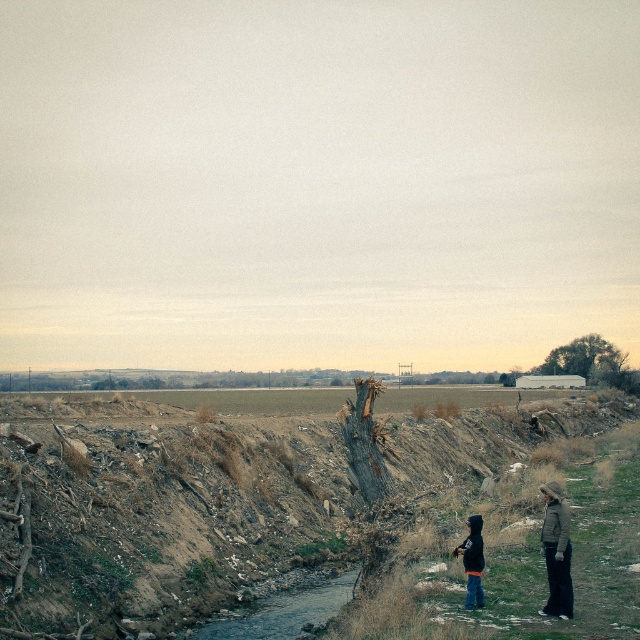
You are standing at the edge of the stream in the rural landscape. You see a point marked as point (284, 611). What is the nature of the area at that point?

The point (284, 611) corresponds to clear water at center, so the area is clear water.

You are a hiker who has lost their jacket. You see the dark gray hoodie at center and the black matte jacket at lower right. Which one is closer to you?

The dark gray hoodie at center is closer to the viewer than the black matte jacket at lower right, so the dark gray hoodie at center is closer to you.